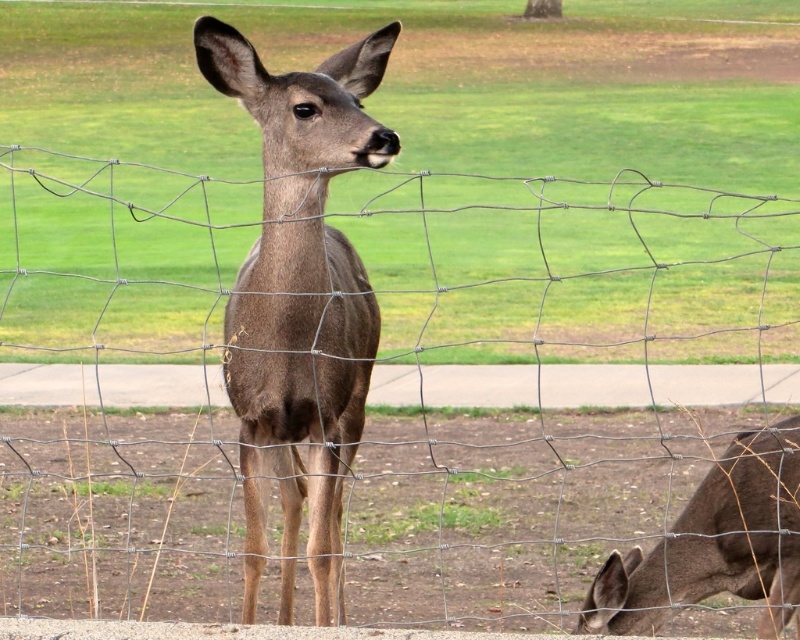
Question: Where is brown matte roe deer at center located in relation to brown matte/deer at lower right in the image?

Choices:
 (A) below
 (B) above

Answer: (B)

Question: Based on their relative distances, which object is farther from the green grass at center?

Choices:
 (A) brown matte roe deer at center
 (B) brown matte/deer at lower right

Answer: (A)

Question: Does green grass at center appear on the right side of brown matte roe deer at center?

Choices:
 (A) yes
 (B) no

Answer: (A)

Question: Which is farther from the brown matte/deer at lower right?

Choices:
 (A) brown matte roe deer at center
 (B) green grass at center

Answer: (B)

Question: Which object is positioned farthest from the green grass at center?

Choices:
 (A) brown matte roe deer at center
 (B) brown matte/deer at lower right

Answer: (A)

Question: Where is green grass at center located in relation to brown matte/deer at lower right in the image?

Choices:
 (A) below
 (B) above

Answer: (B)